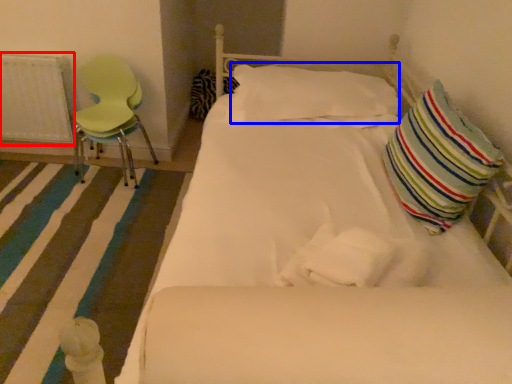
Question: Which point is further to the camera, radiator (highlighted by a red box) or pillow (highlighted by a blue box)?

Choices:
 (A) radiator
 (B) pillow

Answer: (A)